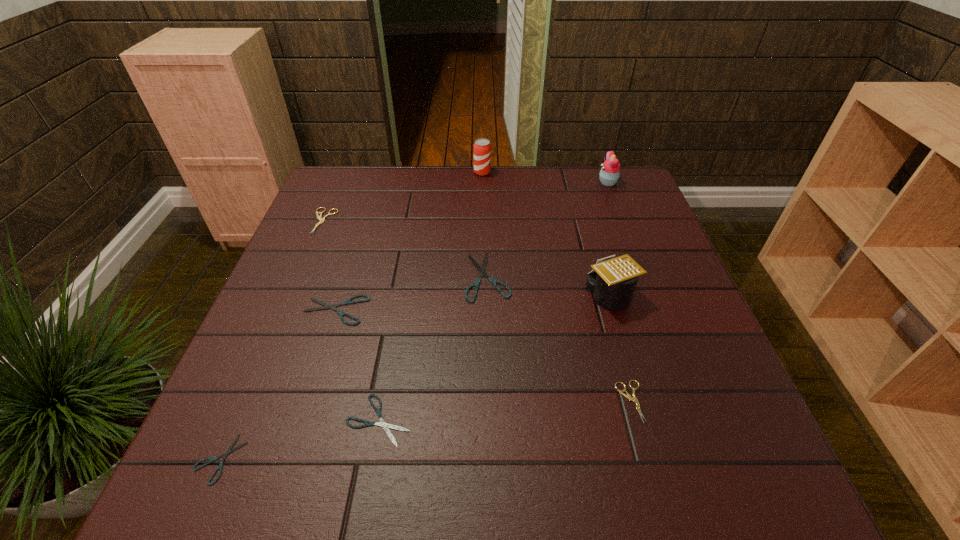
Find the location of a particular element. The image size is (960, 540). the nearer beige shears is located at coordinates (628, 396).

Where is `the third black shears from left to right`? The width and height of the screenshot is (960, 540). the third black shears from left to right is located at coordinates (385, 426).

You are a GUI agent. You are given a task and a screenshot of the screen. Output one action in this format:
    pyautogui.click(x=<x>, y=<y>)
    Task: Click on the sixth object from right to left
    
    Given the screenshot: What is the action you would take?
    pyautogui.click(x=385, y=426)

The height and width of the screenshot is (540, 960). I want to click on the leftmost black shears, so click(229, 450).

Where is `the smallest black shears`? the smallest black shears is located at coordinates (229, 450).

Where is `vacant region located on the front of the beer can`? vacant region located on the front of the beer can is located at coordinates (483, 258).

The image size is (960, 540). I want to click on vacant area situated 0.210m on the face of the cupcake, so click(x=531, y=183).

What are the coordinates of `vacant point located 0.330m on the face of the cupcake` in the screenshot? It's located at 492,183.

Identify the location of vacant point located on the face of the cupcake. Image resolution: width=960 pixels, height=540 pixels. (538, 183).

This screenshot has height=540, width=960. In order to click on vacant position located 0.220m on the front of the calculator in this screenshot , I will do `click(641, 403)`.